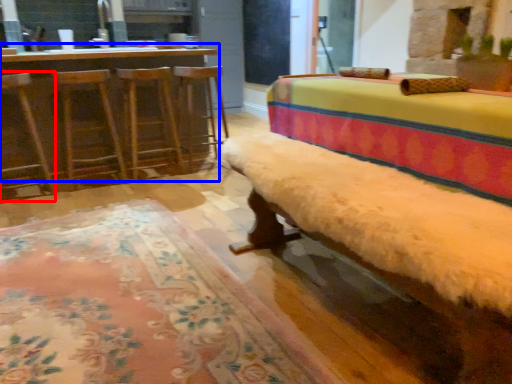
Question: Which object is further to the camera taking this photo, swivel chair (highlighted by a red box) or table (highlighted by a blue box)?

Choices:
 (A) swivel chair
 (B) table

Answer: (B)